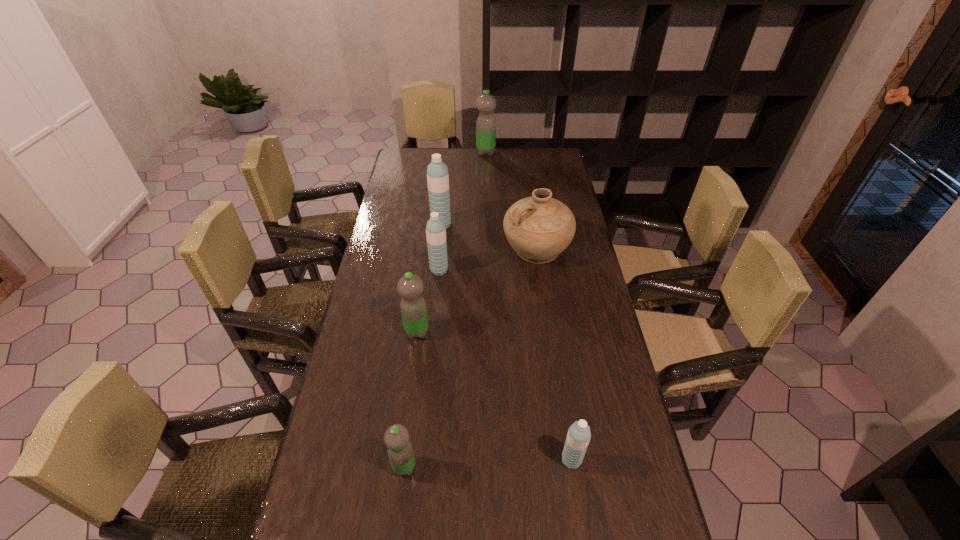
Locate an element on the screen. object that is positioned at the left edge is located at coordinates (413, 307).

Identify the location of pottery that is at the right edge. The image size is (960, 540). (539, 228).

The image size is (960, 540). I want to click on water bottle present at the right edge, so click(578, 437).

Find the location of a particular element. This screenshot has width=960, height=540. free region at the far edge is located at coordinates (465, 153).

The height and width of the screenshot is (540, 960). What are the coordinates of `vacant space at the left edge of the desktop` in the screenshot? It's located at (420, 214).

This screenshot has height=540, width=960. Identify the location of blank space at the right edge. (597, 374).

I want to click on vacant space at the far left corner of the desktop, so click(x=425, y=167).

Find the location of a particular element. The image size is (960, 540). free point between the farthest water bottle and the pottery is located at coordinates (511, 201).

The width and height of the screenshot is (960, 540). I want to click on unoccupied position between the second farthest green water bottle and the pottery, so click(477, 291).

Where is `free space between the rightmost water bottle and the fourth nearest water bottle`? free space between the rightmost water bottle and the fourth nearest water bottle is located at coordinates (505, 365).